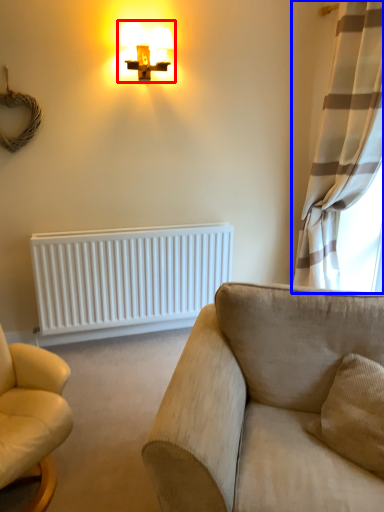
Question: Which object is closer to the camera taking this photo, lamp (highlighted by a red box) or curtain (highlighted by a blue box)?

Choices:
 (A) lamp
 (B) curtain

Answer: (B)